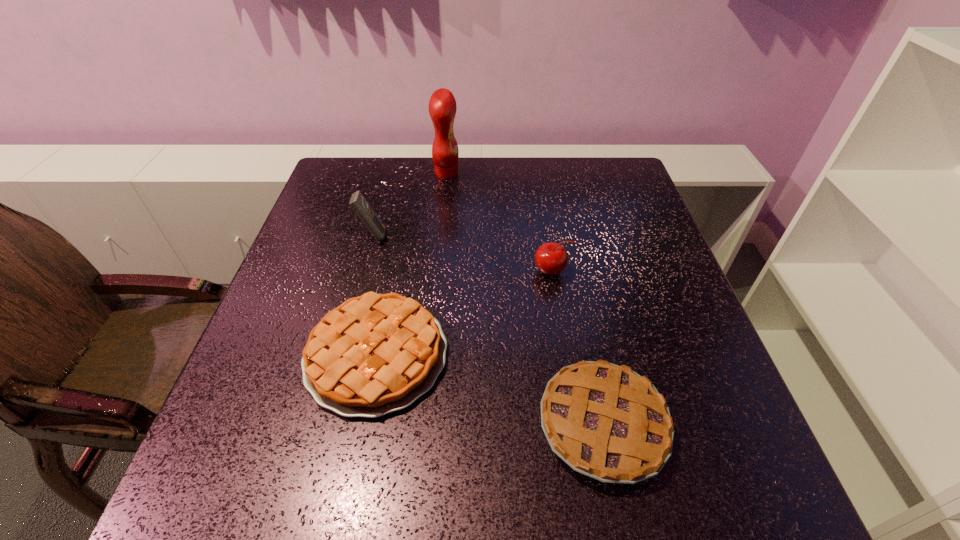
Image resolution: width=960 pixels, height=540 pixels. What are the coordinates of `free point between the right pie and the condiment` in the screenshot? It's located at 524,299.

You are a GUI agent. You are given a task and a screenshot of the screen. Output one action in this format:
    pyautogui.click(x=<x>, y=<y>)
    Task: Click on the empty space that is in between the third farthest object and the right pie
    This screenshot has width=960, height=540.
    Given the screenshot: What is the action you would take?
    pyautogui.click(x=578, y=348)

You are a GUI agent. You are given a task and a screenshot of the screen. Output one action in this format:
    pyautogui.click(x=<x>, y=<y>)
    Task: Click on the vacant area that lies between the right pie and the cherry
    
    Given the screenshot: What is the action you would take?
    click(x=578, y=348)

Locate an element on the screen. free space between the left pie and the farthest object is located at coordinates (412, 264).

The image size is (960, 540). Identify the location of empty space that is in between the fourth nearest object and the right pie. click(488, 330).

This screenshot has height=540, width=960. Identify the location of object that stands as the second closest to the third farthest object. (606, 421).

Point out which object is positioned as the nearest to the fourth nearest object. Please provide its 2D coordinates. Your answer should be formatted as a tuple, i.e. [(x, y)], where the tuple contains the x and y coordinates of a point satisfying the conditions above.

[(374, 354)]

The height and width of the screenshot is (540, 960). In order to click on free location that satisfies the following two spatial constraints: 1. on the label side of the condiment; 2. on the right side of the right pie in this screenshot , I will do `click(421, 425)`.

Locate an element on the screen. vacant area in the image that satisfies the following two spatial constraints: 1. on the front-facing side of the third nearest object; 2. on the right side of the fourth shortest object is located at coordinates (363, 272).

Find the location of a particular element. The image size is (960, 540). vacant point that satisfies the following two spatial constraints: 1. on the front-facing side of the calculator; 2. on the back side of the left pie is located at coordinates (341, 355).